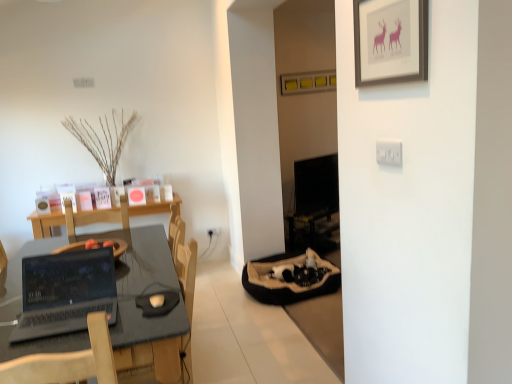
Describe the element at coordinates (65, 292) in the screenshot. I see `silver metallic laptop at lower left` at that location.

What do you see at coordinates (290, 278) in the screenshot?
I see `brown suede pet bed at lower right` at bounding box center [290, 278].

What do you see at coordinates (389, 152) in the screenshot?
I see `white plastic light switch at upper right` at bounding box center [389, 152].

This screenshot has width=512, height=384. Identify the location of white plastic electric outlet at center. (213, 232).

Describe the element at coordinates (213, 232) in the screenshot. The height and width of the screenshot is (384, 512). I see `white plastic electric outlet at center` at that location.

Where is `silver metallic laptop at lower left`? silver metallic laptop at lower left is located at coordinates (65, 292).

Would you say brown suede pet bed at lower right is inside or outside matte pink deer picture frame at upper right?

brown suede pet bed at lower right is spatially situated outside matte pink deer picture frame at upper right.

Considering the positions of points (292, 302) and (388, 20), is point (292, 302) farther from camera compared to point (388, 20)?

Yes.

In the scene shown: Does brown suede pet bed at lower right have a lesser height compared to matte pink deer picture frame at upper right?

Yes.

Is brown suede pet bed at lower right beside matte pink deer picture frame at upper right?

They are not placed beside each other.

Is matte black desk at left located within white plastic electric outlet at center?

Actually, matte black desk at left is outside white plastic electric outlet at center.

From the image's perspective, which one is positioned lower, white plastic electric outlet at center or matte black desk at left?

matte black desk at left is shown below in the image.

Considering the relative positions of white plastic electric outlet at center and matte black desk at left in the image provided, is white plastic electric outlet at center to the left or to the right of matte black desk at left?

white plastic electric outlet at center is to the right of matte black desk at left.

How far apart are white plastic electric outlet at center and matte black desk at left?

8.01 feet.

Considering the sizes of objects matte pink deer picture frame at upper right and matte black desk at left in the image provided, who is thinner, matte pink deer picture frame at upper right or matte black desk at left?

matte pink deer picture frame at upper right.

Considering the sizes of objects matte pink deer picture frame at upper right and matte black desk at left in the image provided, who is shorter, matte pink deer picture frame at upper right or matte black desk at left?

matte pink deer picture frame at upper right.

Between matte pink deer picture frame at upper right and matte black desk at left, which one has larger size?

matte black desk at left.

Between black glossy monitor at center and matte black desk at left, which one has smaller size?

Smaller between the two is black glossy monitor at center.

Can you confirm if black glossy monitor at center is positioned to the right of matte black desk at left?

Yes, black glossy monitor at center is to the right of matte black desk at left.

Is black glossy monitor at center closer to camera compared to matte black desk at left?

No, the depth of black glossy monitor at center is greater than that of matte black desk at left.

Is black glossy monitor at center beside matte black desk at left?

black glossy monitor at center and matte black desk at left are not in contact.

Based on the photo, between black glossy monitor at center and matte pink deer picture frame at upper right, which one appears on the left side from the viewer's perspective?

From the viewer's perspective, matte pink deer picture frame at upper right appears more on the left side.

Which is in front, point (302, 214) or point (415, 16)?

The point (415, 16) is more forward.

Does black glossy monitor at center contain matte pink deer picture frame at upper right?

Definitely not — matte pink deer picture frame at upper right is not inside black glossy monitor at center.

Is there a large distance between black glossy monitor at center and matte pink deer picture frame at upper right?

Indeed, black glossy monitor at center is not near matte pink deer picture frame at upper right.

This screenshot has width=512, height=384. What are the coordinates of `light switch to the right of silver metallic laptop at lower left` in the screenshot? It's located at (389, 152).

What's the angular difference between silver metallic laptop at lower left and white plastic light switch at upper right's facing directions?

The angular difference between silver metallic laptop at lower left and white plastic light switch at upper right is 91.7 degrees.

Are silver metallic laptop at lower left and white plastic light switch at upper right located far from each other?

Indeed, silver metallic laptop at lower left is not near white plastic light switch at upper right.

Does silver metallic laptop at lower left have a lesser height compared to matte black desk at left?

Yes.

From a real-world perspective, is silver metallic laptop at lower left positioned under matte black desk at left based on gravity?

No, from a real-world perspective, silver metallic laptop at lower left is not under matte black desk at left.

Does silver metallic laptop at lower left have a lesser width compared to matte black desk at left?

Yes.

Image resolution: width=512 pixels, height=384 pixels. In order to click on picture frame that appears above the brown suede pet bed at lower right (from the image's perspective) in this screenshot , I will do `click(390, 41)`.

This screenshot has height=384, width=512. In order to click on desk in front of the white plastic electric outlet at center in this screenshot , I will do `click(147, 293)`.

Looking at this image, which object lies nearer to the anchor point white plastic electric outlet at center, brown suede pet bed at lower right or matte black desk at left?

Among the two, brown suede pet bed at lower right is located nearer to white plastic electric outlet at center.

When comparing their distances from silver metallic laptop at lower left, does matte black desk at left or white plastic light switch at upper right seem further?

white plastic light switch at upper right.

Based on the photo, when comparing their distances from white plastic electric outlet at center, does silver metallic laptop at lower left or brown suede pet bed at lower right seem closer?

The object closer to white plastic electric outlet at center is brown suede pet bed at lower right.

Looking at the image, which one is located further to matte black desk at left, white plastic electric outlet at center or brown suede pet bed at lower right?

white plastic electric outlet at center lies further to matte black desk at left than the other object.

In the scene shown: Considering their positions, is white plastic light switch at upper right positioned closer to brown suede pet bed at lower right than white plastic electric outlet at center?

Based on the image, white plastic electric outlet at center appears to be nearer to brown suede pet bed at lower right.

When comparing their distances from black glossy monitor at center, does white plastic light switch at upper right or matte pink deer picture frame at upper right seem further?

white plastic light switch at upper right lies further to black glossy monitor at center than the other object.

Based on their spatial positions, is white plastic light switch at upper right or matte black desk at left further from silver metallic laptop at lower left?

white plastic light switch at upper right is further to silver metallic laptop at lower left.

From the image, which object appears to be farther from matte pink deer picture frame at upper right, white plastic light switch at upper right or matte black desk at left?

matte black desk at left is positioned further to the anchor matte pink deer picture frame at upper right.

Where is `laptop between matte black desk at left and white plastic electric outlet at center along the z-axis`? This screenshot has height=384, width=512. laptop between matte black desk at left and white plastic electric outlet at center along the z-axis is located at coordinates (65, 292).

Identify the location of wide positioned between silver metallic laptop at lower left and black glossy monitor at center from near to far. The width and height of the screenshot is (512, 384). (290, 278).

Find the location of a particular element. The image size is (512, 384). laptop between white plastic light switch at upper right and white plastic electric outlet at center along the z-axis is located at coordinates (65, 292).

At what (x,y) coordinates should I click in order to perform the action: click on laptop located between matte pink deer picture frame at upper right and white plastic electric outlet at center in the depth direction. Please return your answer as a coordinate pair (x, y). The width and height of the screenshot is (512, 384). Looking at the image, I should click on (65, 292).